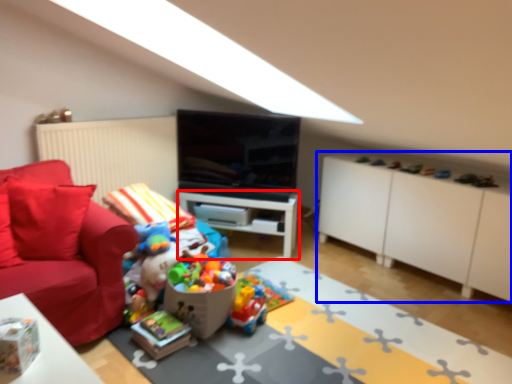
Question: Which object appears closest to the camera in this image, table (highlighted by a red box) or cabinetry (highlighted by a blue box)?

Choices:
 (A) table
 (B) cabinetry

Answer: (B)